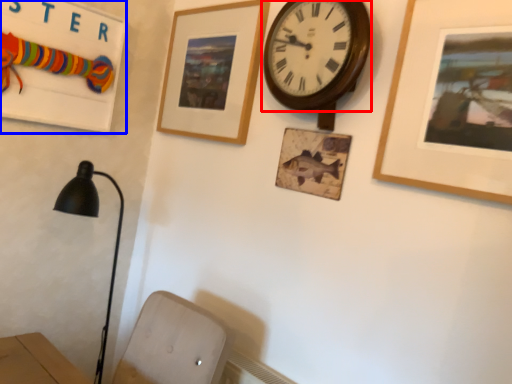
Question: Which object appears farthest to the camera in this image, wall clock (highlighted by a red box) or bulletin board (highlighted by a blue box)?

Choices:
 (A) wall clock
 (B) bulletin board

Answer: (B)